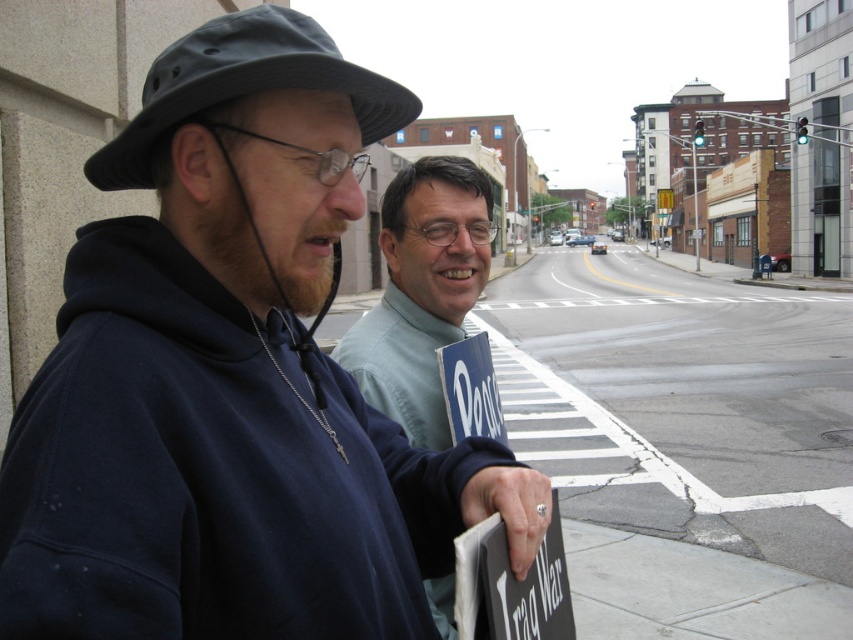
Question: In this image, where is dark blue hoodie at left located relative to light blue shirt at center?

Choices:
 (A) right
 (B) left

Answer: (B)

Question: Estimate the real-world distances between objects in this image. Which object is closer to the dark blue hoodie at left?

Choices:
 (A) light blue shirt at center
 (B) dark gray fabric fedora at left

Answer: (B)

Question: Considering the relative positions of light blue shirt at center and dark gray fabric fedora at left in the image provided, where is light blue shirt at center located with respect to dark gray fabric fedora at left?

Choices:
 (A) right
 (B) left

Answer: (A)

Question: Which of the following is the farthest from the observer?

Choices:
 (A) dark blue hoodie at left
 (B) light blue shirt at center
 (C) dark gray fabric fedora at left

Answer: (B)

Question: Is the position of light blue shirt at center more distant than that of dark gray fabric fedora at left?

Choices:
 (A) yes
 (B) no

Answer: (A)

Question: Which object is positioned closest to the light blue shirt at center?

Choices:
 (A) dark blue hoodie at left
 (B) dark gray fabric fedora at left

Answer: (A)